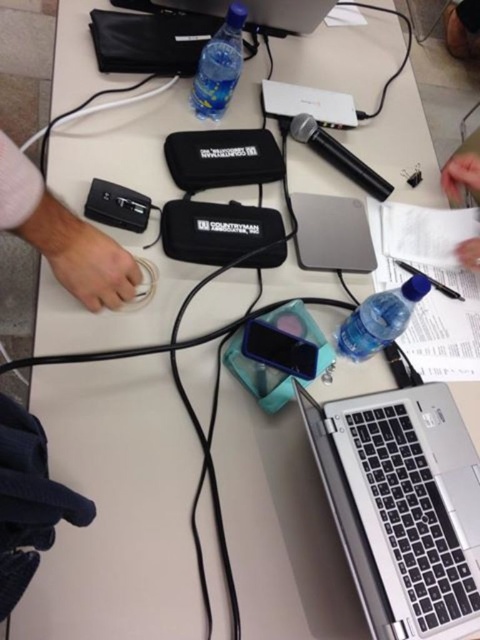
You are an audio engineer setting up for a recording session. You need to place a new document on the table without moving any existing equipment. The white paper at upper right and the black plastic pen at right are already present. Where should you place the new document to ensure it doesn

The white paper at upper right is positioned on the right side of the black plastic pen at right. To place the new document without moving existing items, you should put it to the left of the black plastic pen at right or to the left of the white paper at upper right.

You are organizing the items on the table and need to place the white paper at upper right and the black plastic pen at right into a drawer. Which item should you place first to avoid blocking access to the other?

You should place the white paper at upper right first because it is located above the black plastic pen at right, so placing it first will prevent blocking access to the pen below.

You are organizing the items on the table and need to place the translucent plastic bottle at lower right and the silver metallic laptop at upper center. According to their positions, which item is closer to the edge of the table?

The translucent plastic bottle at lower right is closer to the edge of the table because it is positioned below the silver metallic laptop at upper center.